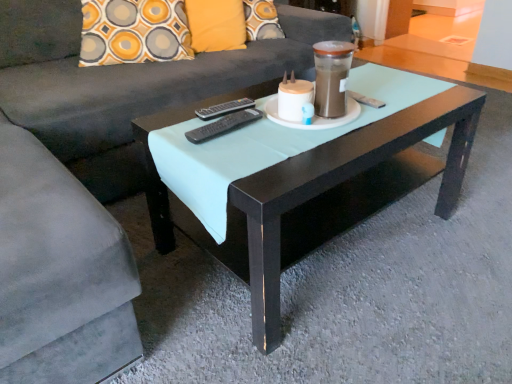
The image size is (512, 384). I want to click on free space on the front side of black plastic remote at center, the 1th remote in the back-to-front sequence, so click(x=228, y=134).